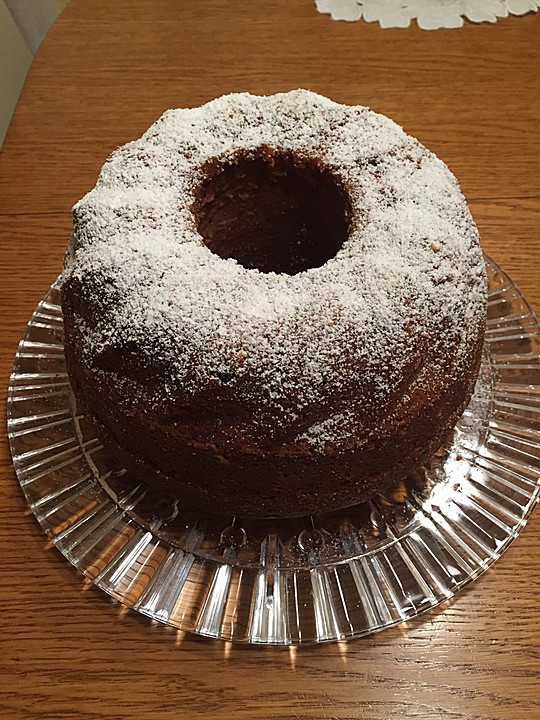
Where is `table`? This screenshot has height=720, width=540. table is located at coordinates (207, 688), (120, 80).